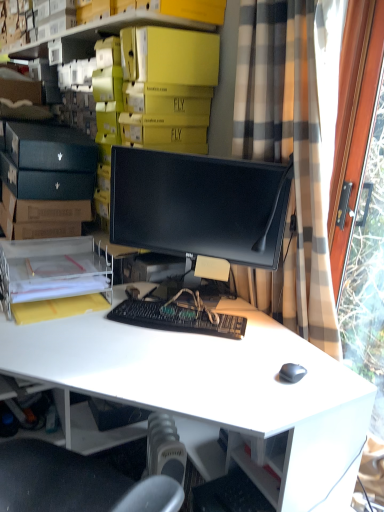
Where is `vacant space to the right of black matte keyboard at center`? vacant space to the right of black matte keyboard at center is located at coordinates [x=267, y=343].